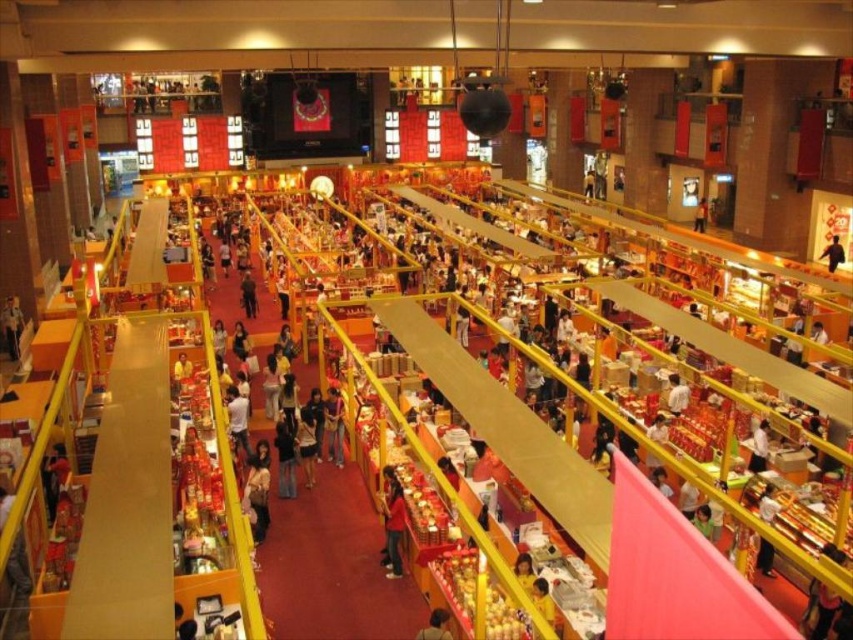
Question: Based on their relative distances, which object is nearer to the yellow fabric at center?

Choices:
 (A) red matte shirt at center
 (B) white fabric shirt at lower right
 (C) black leather jacket at center

Answer: (A)

Question: Can you confirm if red matte shirt at center is positioned above matte black shirt at center?

Choices:
 (A) no
 (B) yes

Answer: (A)

Question: Which point appears closest to the camera in this image?

Choices:
 (A) (689, 394)
 (B) (339, 467)
 (C) (550, 614)

Answer: (C)

Question: Is white fabric shirt at center closer to the viewer compared to black leather jacket at center?

Choices:
 (A) no
 (B) yes

Answer: (B)

Question: Does red matte shirt at center lie behind matte black shirt at center?

Choices:
 (A) yes
 (B) no

Answer: (B)

Question: Which point is closer to the camera?

Choices:
 (A) (666, 403)
 (B) (433, 618)
 (C) (831, 243)

Answer: (B)